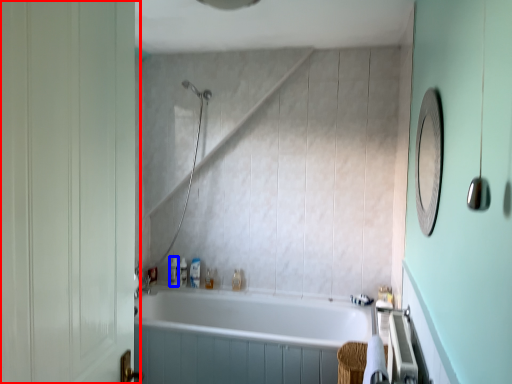
Question: Which object appears farthest to the camera in this image, screen door (highlighted by a red box) or toiletry (highlighted by a blue box)?

Choices:
 (A) screen door
 (B) toiletry

Answer: (B)